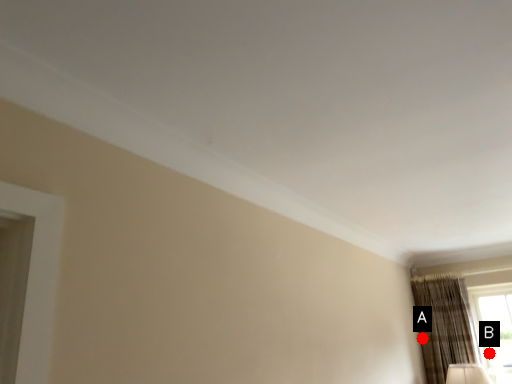
Question: Two points are circled on the image, labeled by A and B beside each circle. Among these points, which one is nearest to the camera?

Choices:
 (A) A is closer
 (B) B is closer

Answer: (A)